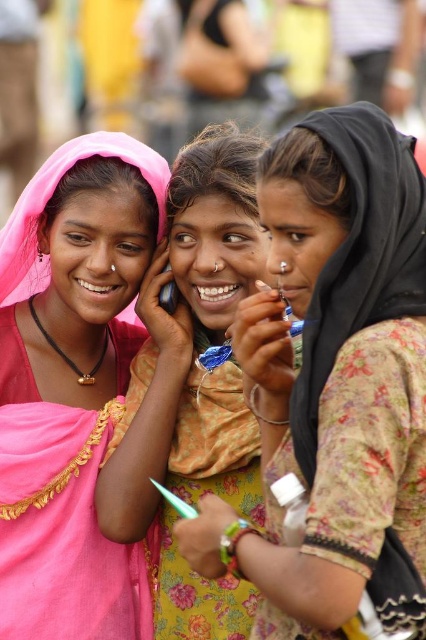
Question: Observing the image, what is the correct spatial positioning of floral fabric dress at center in reference to pink fabric headscarf at center?

Choices:
 (A) left
 (B) right

Answer: (B)

Question: Based on their relative distances, which object is farther from the pink fabric headscarf at center?

Choices:
 (A) floral fabric dress at center
 (B) matte plastic phone at center

Answer: (A)

Question: Which point is farther to the camera?

Choices:
 (A) pink fabric headscarf at center
 (B) floral fabric dress at center
 (C) matte plastic phone at center
 (D) pink fabric saree at left

Answer: (C)

Question: Is floral fabric dress at center to the left of matte plastic phone at center from the viewer's perspective?

Choices:
 (A) yes
 (B) no

Answer: (B)

Question: Is pink fabric headscarf at center closer to camera compared to matte plastic phone at center?

Choices:
 (A) no
 (B) yes

Answer: (B)

Question: Considering the real-world distances, which object is closest to the pink fabric headscarf at center?

Choices:
 (A) matte plastic phone at center
 (B) floral fabric dress at center
 (C) pink fabric saree at left

Answer: (C)